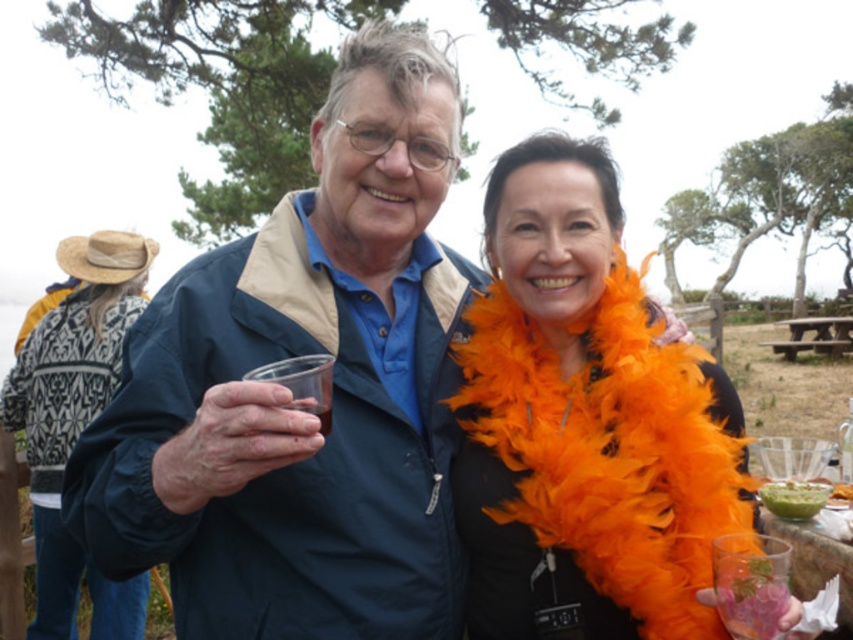
You are standing at the point marked as point (431, 304) in the image. You want to walk straight ahead. How far will you have to walk before you can no longer see the two people in the foreground?

The distance of point (431, 304) from viewer is 2.11 meters. Therefore, you will have to walk 2.11 meters before you can no longer see the two people in the foreground.

You are organizing a costume party and need to ensure that all accessories are visible. Given the blue fabric jacket at center and the orange feather boa at center, which one would you recommend placing closer to the camera to ensure visibility?

The blue fabric jacket at center has a larger width than the orange feather boa at center, so placing the blue fabric jacket at center closer to the camera would ensure better visibility due to its greater size.

You are at a picnic and want to grab your drink. Which object is closer to you between the translucent plastic cup at center and the wooden picnic table at center?

The wooden picnic table at center is closer to you than the translucent plastic cup at center, so you should reach for the wooden picnic table at center first.